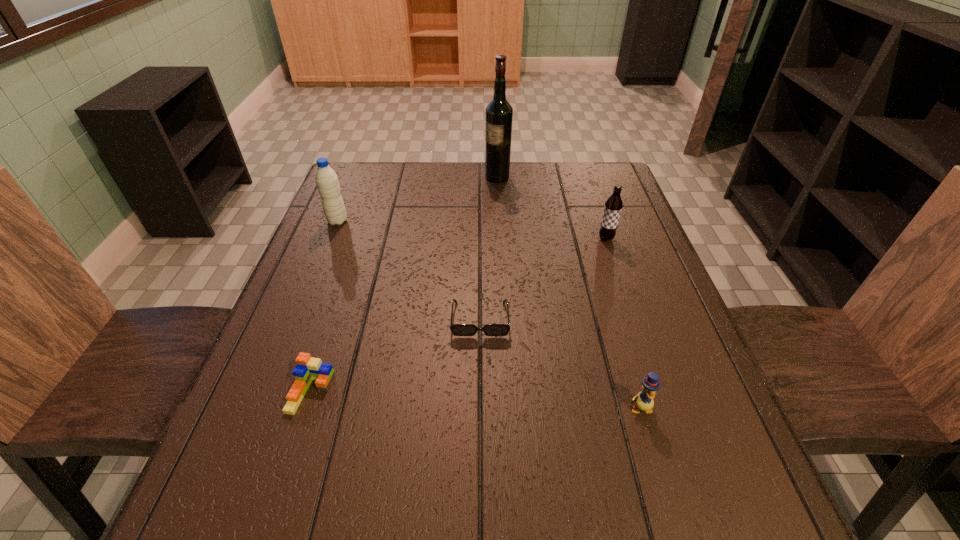
This screenshot has width=960, height=540. I want to click on unoccupied area between the root beer and the second farthest object, so click(471, 230).

In order to click on blank region between the water bottle and the farthest object in this screenshot , I will do `click(418, 199)`.

You are a GUI agent. You are given a task and a screenshot of the screen. Output one action in this format:
    pyautogui.click(x=<x>, y=<y>)
    Task: Click on the free space between the water bottle and the fourth tallest object
    
    Given the screenshot: What is the action you would take?
    pyautogui.click(x=489, y=314)

At what (x,y) coordinates should I click in order to perform the action: click on unoccupied position between the duckling and the fourth farthest object. Please return your answer as a coordinate pair (x, y). The width and height of the screenshot is (960, 540). Looking at the image, I should click on (560, 363).

Find the location of a particular element. vacant area that lies between the third nearest object and the tallest object is located at coordinates (489, 248).

Find the location of a particular element. This screenshot has height=540, width=960. free space between the water bottle and the sunglasses is located at coordinates (409, 270).

Locate an element on the screen. This screenshot has height=540, width=960. vacant space in between the third nearest object and the tallest object is located at coordinates (489, 248).

Locate an element on the screen. This screenshot has width=960, height=540. vacant space in between the duckling and the fourth nearest object is located at coordinates (623, 323).

Identify the location of vacant area between the leftmost object and the sunglasses. (409, 270).

Identify the location of vacant area between the shortest object and the wine bottle. [489, 248].